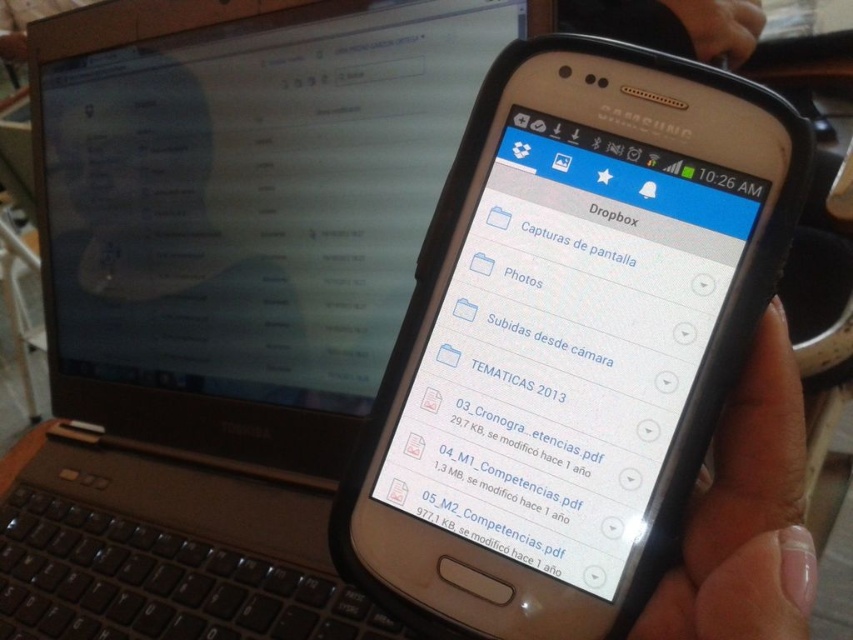
From the picture: Between matte black laptop at left and light skin tone flesh at lower right, which one appears on the right side from the viewer's perspective?

light skin tone flesh at lower right

How much distance is there between matte black laptop at left and light skin tone flesh at lower right?

matte black laptop at left is 18.62 inches from light skin tone flesh at lower right.

Does point (299, 307) come closer to viewer compared to point (746, 460)?

That is False.

Image resolution: width=853 pixels, height=640 pixels. I want to click on matte black laptop at left, so click(x=254, y=195).